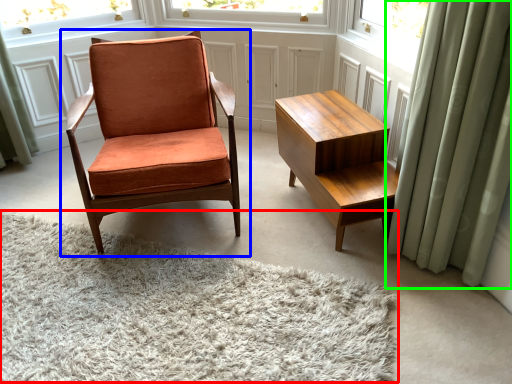
Question: Which object is the farthest from plain (highlighted by a red box)? Choose among these: chair (highlighted by a blue box) or curtain (highlighted by a green box).

Choices:
 (A) chair
 (B) curtain

Answer: (B)